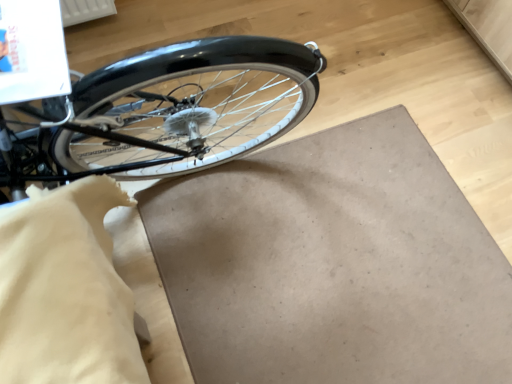
This screenshot has width=512, height=384. I want to click on brown cardboard at upper left, so click(x=333, y=264).

What do you see at coordinates (333, 264) in the screenshot? I see `brown cardboard at upper left` at bounding box center [333, 264].

Identify the location of brown cardboard at upper left. (333, 264).